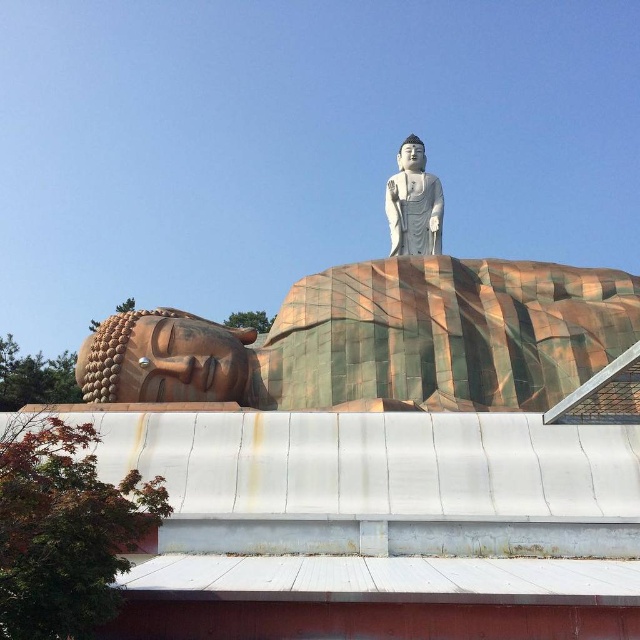
You are an art student observing the two statues in the scene. Which statue is positioned closer to you, the gold textured statue at lower left or the white marble statue at upper center?

The gold textured statue at lower left is closer to the viewer than the white marble statue at upper center.

You are an art curator planning to install a new sculpture between the gold textured statue at lower left and the white marble statue at upper center. Based on their sizes, which statue should you consider placing closer to the entrance to ensure visitors can easily view both? Please explain your reasoning.

The gold textured statue at lower left might be wider than the white marble statue at upper center, so placing the wider gold textured statue at lower left closer to the entrance would allow visitors to first see its broader form before moving towards the potentially more intricate details of the white marble statue at upper center.